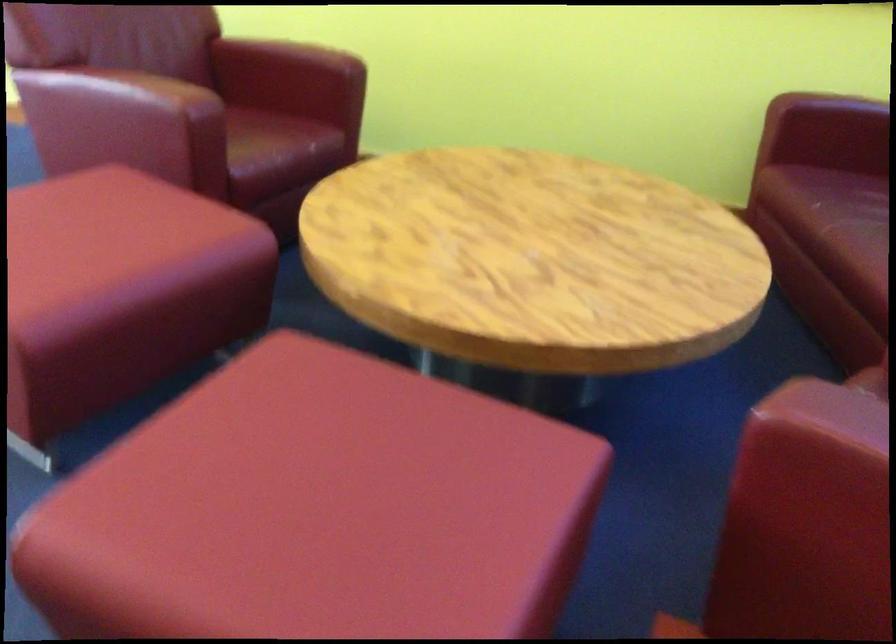
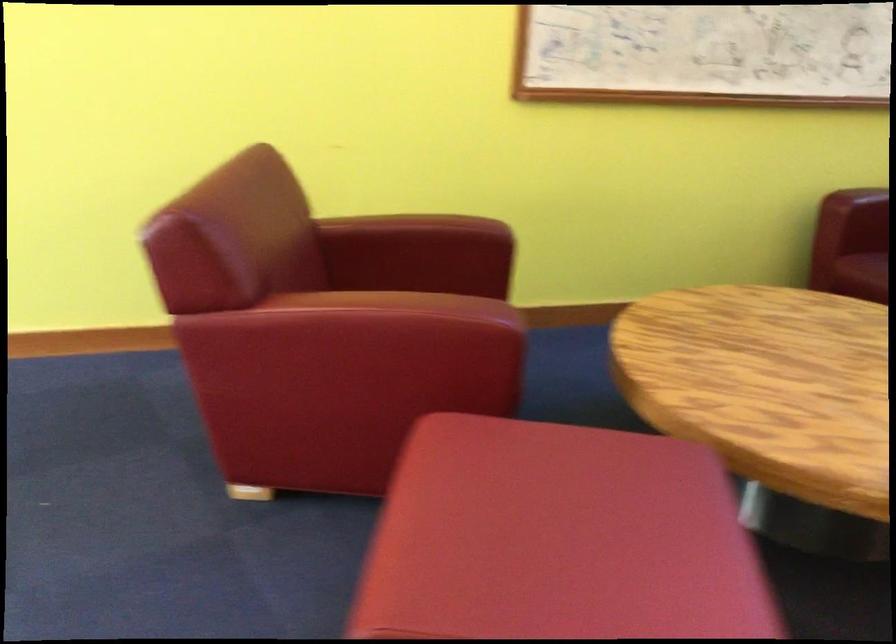
Find the pixel in the second image that matches (x=102, y=70) in the first image.

(356, 301)